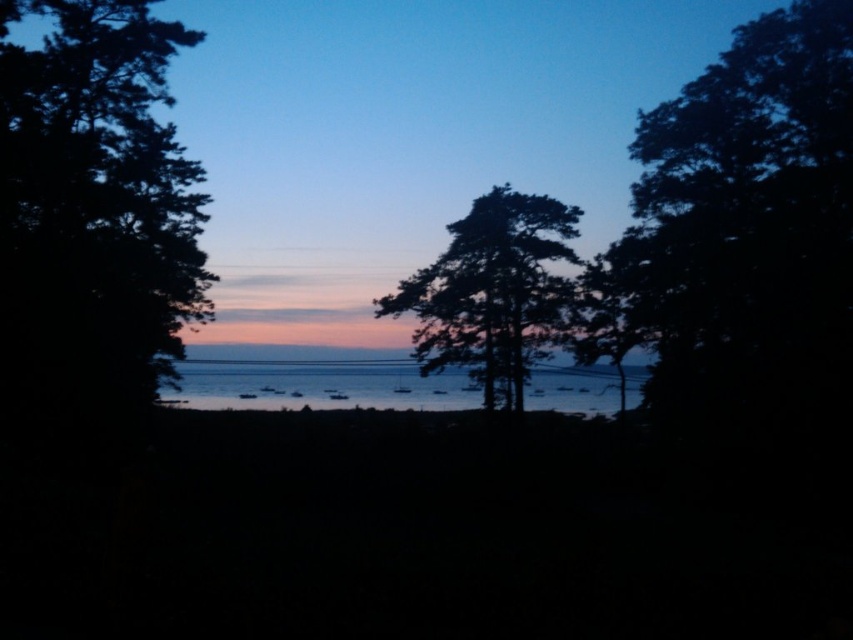
You are standing at the edge of the water in the twilight scene. There are two points marked in the image. Which point, point (x=503, y=323) or point (x=274, y=403), is closer to you?

Point (x=503, y=323) is closer to the viewer than point (x=274, y=403).

You are standing in the twilight scene and want to walk towards the silhouette wood tree at center and the silvery reflective water at center. Which object will you encounter first?

You will encounter the silhouette wood tree at center first because it is closer to you than the silvery reflective water at center, which is further away.